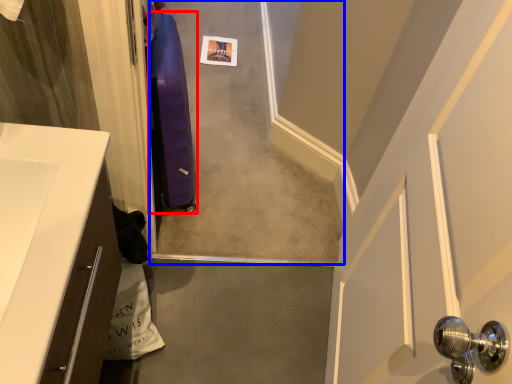
Question: Among these objects, which one is farthest to the camera, luggage (highlighted by a red box) or concrete (highlighted by a blue box)?

Choices:
 (A) luggage
 (B) concrete

Answer: (B)